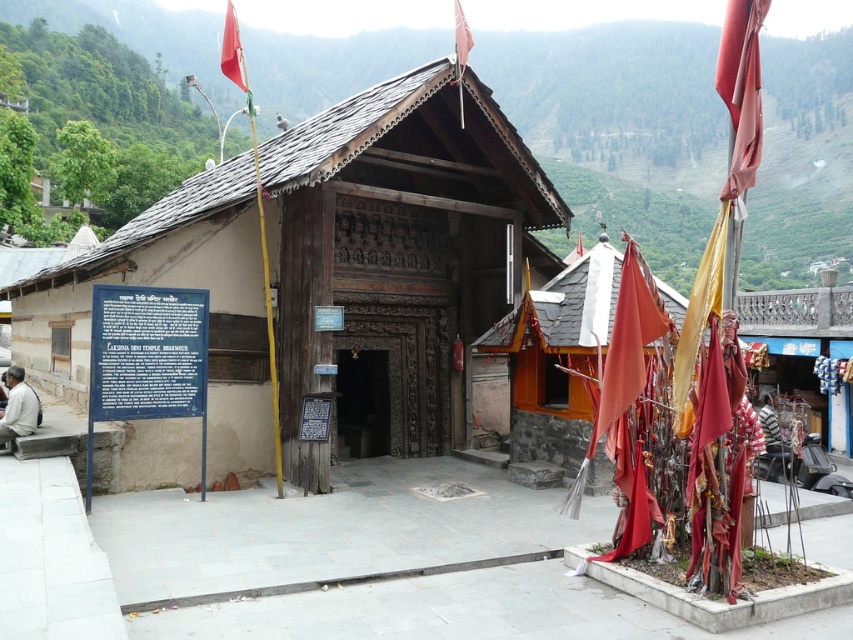
Question: Which point appears farthest from the camera in this image?

Choices:
 (A) (737, 120)
 (B) (222, 61)
 (C) (566, 321)

Answer: (C)

Question: Can you confirm if red fabric flag at upper right is wider than dark wood door at center?

Choices:
 (A) no
 (B) yes

Answer: (B)

Question: Which point is closer to the camera?

Choices:
 (A) wooden shrine at center
 (B) light beige stone man at lower left
 (C) red fabric flag at upper right

Answer: (C)

Question: Can you confirm if wooden shrine at center is positioned to the right of shiny red flag at upper left?

Choices:
 (A) no
 (B) yes

Answer: (B)

Question: Considering the relative positions of wooden shrine at center and shiny red flag at upper left in the image provided, where is wooden shrine at center located with respect to shiny red flag at upper left?

Choices:
 (A) left
 (B) right

Answer: (B)

Question: Which of the following is the closest to the observer?

Choices:
 (A) light beige stone man at lower left
 (B) wooden carved door at center
 (C) dark wood door at center

Answer: (A)